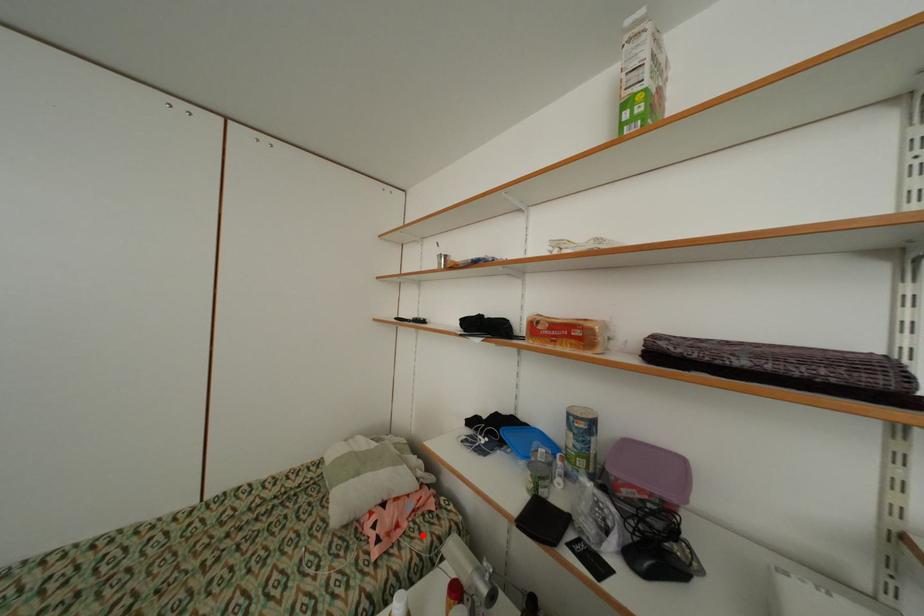
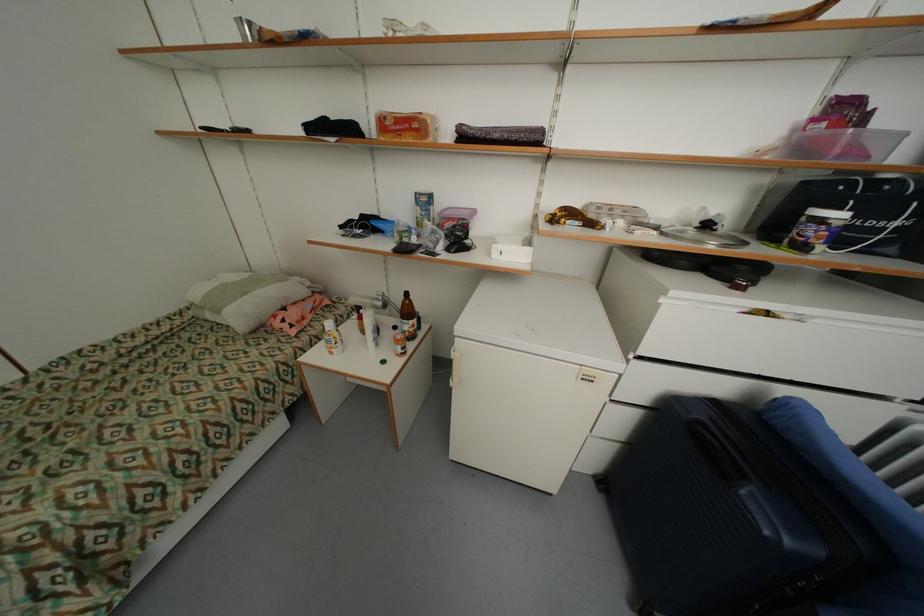
Question: I am providing you with two images of the same scene from different viewpoints. Given a red point in image1, look at the same physical point in image2. Is it:

Choices:
 (A) Closer to the viewpoint
 (B) Farther from the viewpoint

Answer: (B)